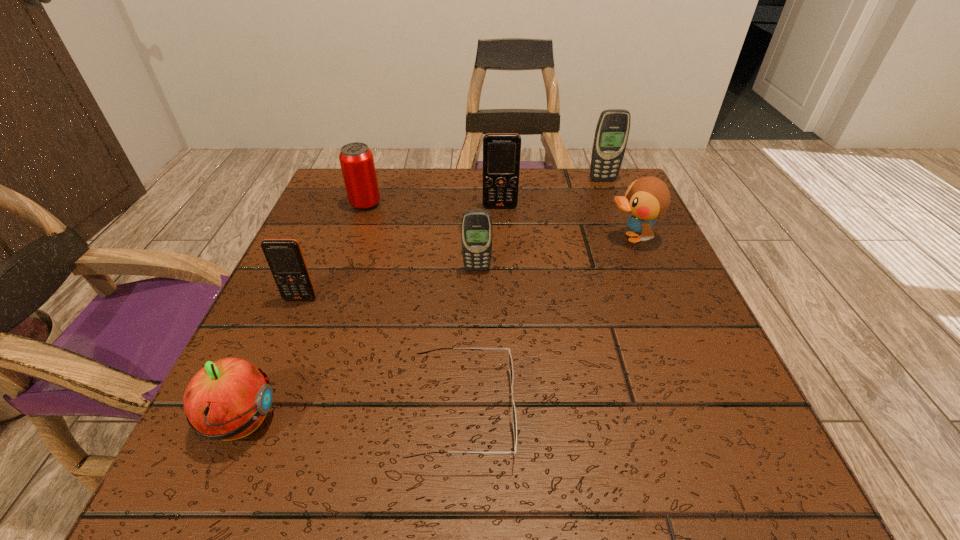
Where is `object that is the fourth closest one to the can`? This screenshot has height=540, width=960. object that is the fourth closest one to the can is located at coordinates (513, 410).

This screenshot has width=960, height=540. I want to click on cellular telephone that is the third closest to the second farthest cellular telephone, so click(285, 258).

Locate an element on the screen. This screenshot has width=960, height=540. the fourth closest cellular telephone relative to the duck is located at coordinates (285, 258).

The width and height of the screenshot is (960, 540). In order to click on vacant space that satisfies the following two spatial constraints: 1. on the screen of the nearer gray cellular telephone; 2. on the front-facing side of the shortest object in this screenshot , I will do `click(476, 411)`.

Where is `free space that satisfies the following two spatial constraints: 1. on the front-facing side of the duck; 2. on the front side of the apple`? This screenshot has width=960, height=540. free space that satisfies the following two spatial constraints: 1. on the front-facing side of the duck; 2. on the front side of the apple is located at coordinates [x=708, y=422].

Where is `vacant area in the image that satisfies the following two spatial constraints: 1. on the screen of the fourth nearest object; 2. on the front-facing side of the shortest object`? This screenshot has width=960, height=540. vacant area in the image that satisfies the following two spatial constraints: 1. on the screen of the fourth nearest object; 2. on the front-facing side of the shortest object is located at coordinates (476, 411).